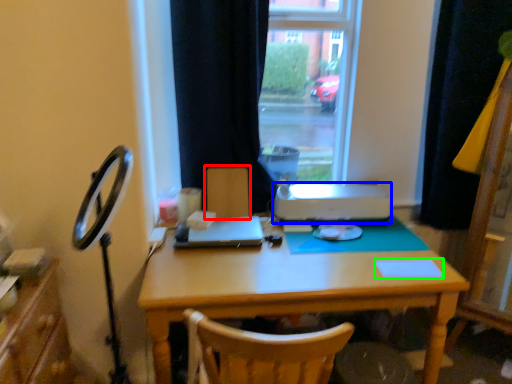
Question: Which object is positioned farthest from armchair (highlighted by a red box)? Select from printer (highlighted by a blue box) and notepad (highlighted by a green box).

Choices:
 (A) printer
 (B) notepad

Answer: (B)